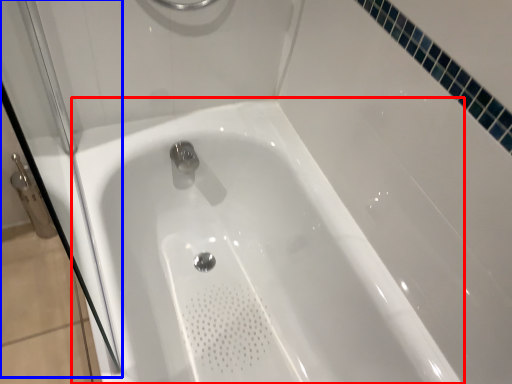
Question: Which of the following is the farthest to the observer, bathtub (highlighted by a red box) or shower door (highlighted by a blue box)?

Choices:
 (A) bathtub
 (B) shower door

Answer: (A)